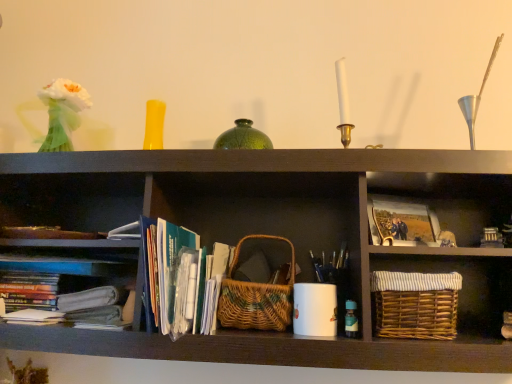
Question: Considering their positions, is translucent glass bottle at lower right located in front of or behind matte paper photo at center right?

Choices:
 (A) behind
 (B) front

Answer: (B)

Question: Considering the relative positions of translucent glass bottle at lower right and matte paper photo at center right in the image provided, is translucent glass bottle at lower right to the left or to the right of matte paper photo at center right?

Choices:
 (A) left
 (B) right

Answer: (A)

Question: Which of these objects is positioned farthest from the green paperbacks at center?

Choices:
 (A) woven brown basket at lower right, the 2th basket when ordered from left to right
 (B) woven natural basket at center, which ranks as the 2th basket in right-to-left order
 (C) matte paper photo at center right
 (D) translucent glass bottle at lower right

Answer: (C)

Question: Estimate the real-world distances between objects in this image. Which object is closer to the translucent glass bottle at lower right?

Choices:
 (A) green paperbacks at center
 (B) matte paper photo at center right
 (C) woven natural basket at center, which ranks as the 2th basket in right-to-left order
 (D) woven brown basket at lower right, the 2th basket when ordered from left to right

Answer: (D)